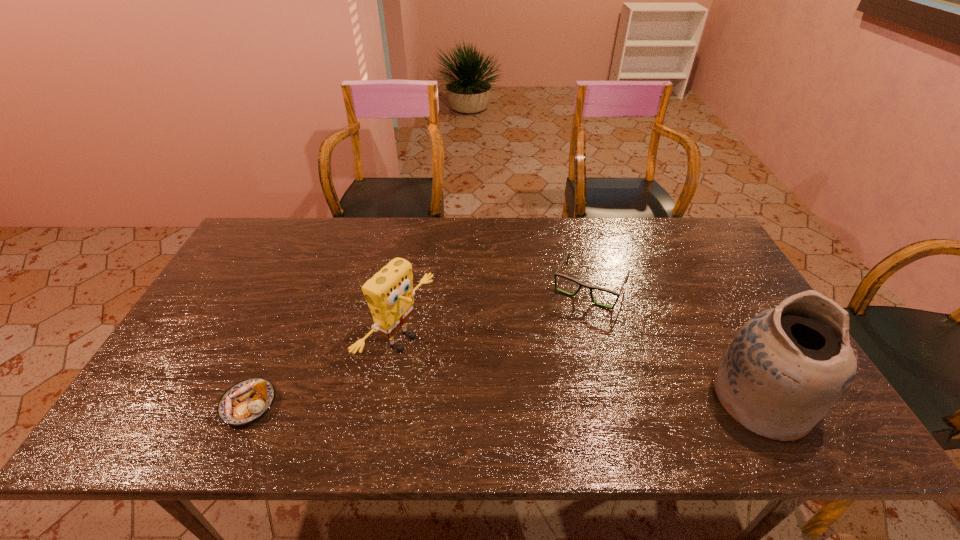
The height and width of the screenshot is (540, 960). I want to click on free area in between the tallest object and the spectacles, so click(x=675, y=343).

Locate an element on the screen. blank region between the third object from left to right and the tallest object is located at coordinates (675, 343).

Find the location of `unoccupied position between the pottery and the third shortest object`. unoccupied position between the pottery and the third shortest object is located at coordinates (581, 370).

The image size is (960, 540). What are the coordinates of `free area in between the pottery and the second shortest object` in the screenshot? It's located at (675, 343).

Where is `blank region between the second shortest object and the shortest object`? The height and width of the screenshot is (540, 960). blank region between the second shortest object and the shortest object is located at coordinates (420, 346).

Identify which object is the nearest to the second object from left to right. Please provide its 2D coordinates. Your answer should be formatted as a tuple, i.e. [(x, y)], where the tuple contains the x and y coordinates of a point satisfying the conditions above.

[(245, 402)]

The width and height of the screenshot is (960, 540). What are the coordinates of `object that is the third nearest to the third object from left to right` in the screenshot? It's located at (245, 402).

At what (x,y) coordinates should I click in order to perform the action: click on free location that satisfies the following two spatial constraints: 1. on the back side of the second tallest object; 2. on the right side of the leftmost object. Please return your answer as a coordinate pair (x, y). This screenshot has height=540, width=960. Looking at the image, I should click on (276, 340).

I want to click on vacant area in the image that satisfies the following two spatial constraints: 1. on the back side of the sponge; 2. on the right side of the shortest object, so click(276, 340).

Where is `vacant space that satisfies the following two spatial constraints: 1. on the back side of the sponge; 2. on the right side of the shortest object`? The image size is (960, 540). vacant space that satisfies the following two spatial constraints: 1. on the back side of the sponge; 2. on the right side of the shortest object is located at coordinates (276, 340).